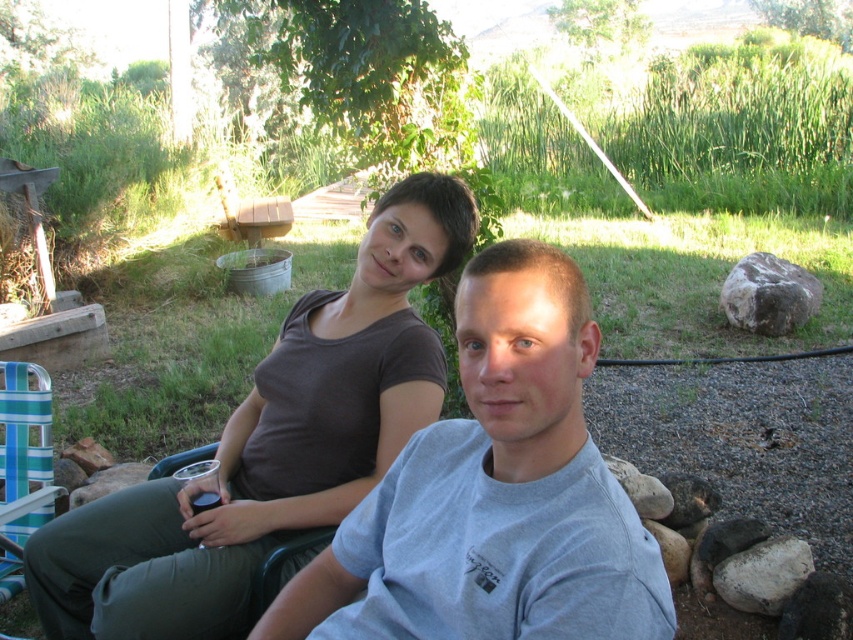
Question: Does gray cotton t-shirt at center have a greater width compared to gray rough rock at right?

Choices:
 (A) yes
 (B) no

Answer: (B)

Question: Does gray rough rock at right have a smaller size compared to green plastic chair at lower left?

Choices:
 (A) no
 (B) yes

Answer: (A)

Question: From the image, what is the correct spatial relationship of matte brown shirt at upper center in relation to green plastic chair at lower left?

Choices:
 (A) left
 (B) right

Answer: (A)

Question: Which object appears farthest from the camera in this image?

Choices:
 (A) matte brown shirt at upper center
 (B) green plastic chair at lower left

Answer: (B)

Question: Considering the real-world distances, which object is farthest from the matte brown shirt at upper center?

Choices:
 (A) teal striped plastic chair at lower left
 (B) gray cotton t-shirt at center
 (C) gray rough rock at right
 (D) green plastic chair at lower left

Answer: (C)

Question: Which object is farther from the camera taking this photo?

Choices:
 (A) teal striped plastic chair at lower left
 (B) gray rough rock at right
 (C) matte brown shirt at upper center

Answer: (B)